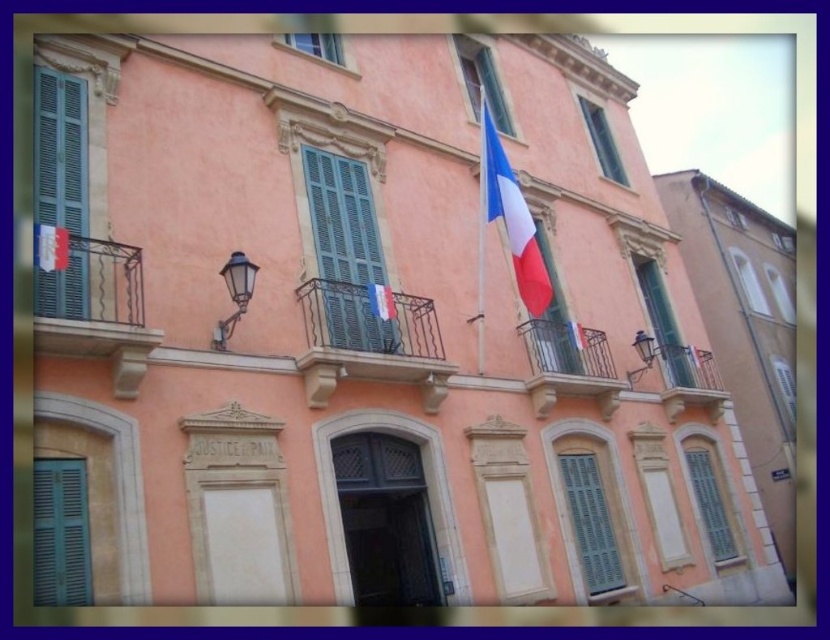
Consider the image. Can you confirm if green matte shutters at left is taller than metallic brass balcony at upper right?

Correct, green matte shutters at left is much taller as metallic brass balcony at upper right.

Does green matte shutters at left come in front of metallic brass balcony at upper right?

Yes, it is in front of metallic brass balcony at upper right.

The width and height of the screenshot is (830, 640). Describe the element at coordinates (61, 188) in the screenshot. I see `green matte shutters at left` at that location.

What are the coordinates of `green matte shutters at left` in the screenshot? It's located at (61, 188).

Is rustic wood balcony at center to the left of clear glass window at center from the viewer's perspective?

Indeed, rustic wood balcony at center is positioned on the left side of clear glass window at center.

Is point (545, 342) farther from viewer compared to point (792, 406)?

No.

Which is in front, point (572, 376) or point (779, 358)?

Point (572, 376) is more forward.

You are a GUI agent. You are given a task and a screenshot of the screen. Output one action in this format:
    pyautogui.click(x=<x>, y=<y>)
    Task: Click on the rustic wood balcony at center
    The image size is (830, 640).
    Given the screenshot: What is the action you would take?
    pyautogui.click(x=569, y=365)

Can you confirm if matte glass window at upper center is taller than matte glass window at center?

In fact, matte glass window at upper center may be shorter than matte glass window at center.

Between point (335, 36) and point (787, 292), which one is positioned behind?

Point (787, 292)

Where is `matte glass window at upper center`? Image resolution: width=830 pixels, height=640 pixels. matte glass window at upper center is located at coordinates (316, 44).